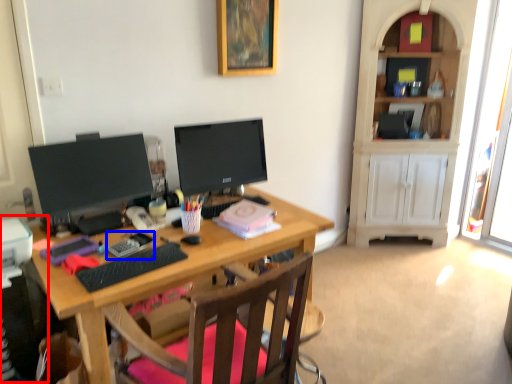
Question: Which of the following is the farthest to the observer, computer tower (highlighted by a red box) or stationery (highlighted by a blue box)?

Choices:
 (A) computer tower
 (B) stationery

Answer: (B)